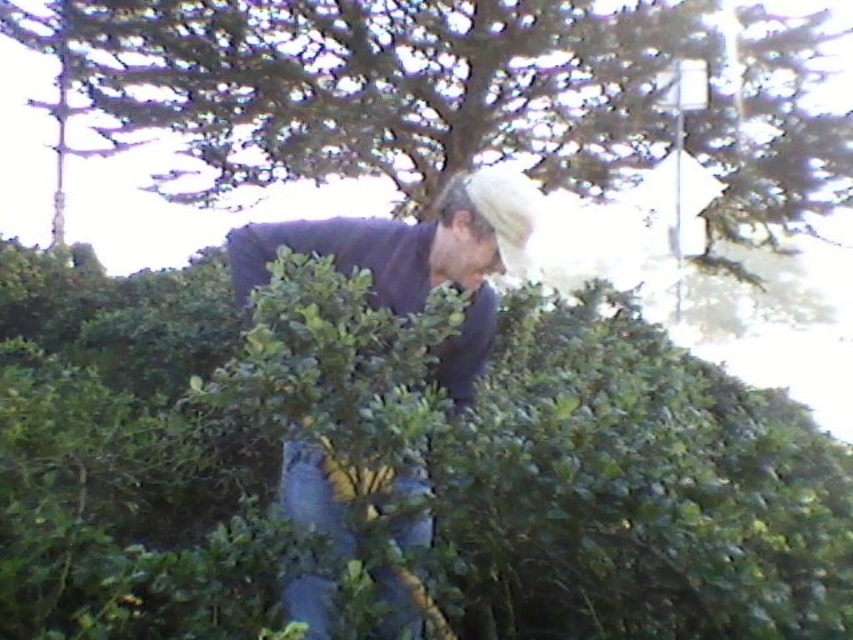
You are a photographer trying to capture the gardener in the scene. If you want to focus on the dark blue sweater at center, where should you aim your camera?

You should aim your camera at point 0.405 on the x axis and 0.489 on the y axis to focus on the dark blue sweater at center.